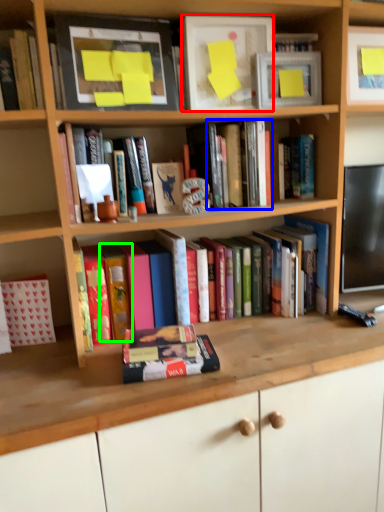
Question: Considering the real-world distances, which object is closest to paperback book (highlighted by a red box)? book (highlighted by a blue box) or paperback book (highlighted by a green box).

Choices:
 (A) book
 (B) paperback book

Answer: (A)